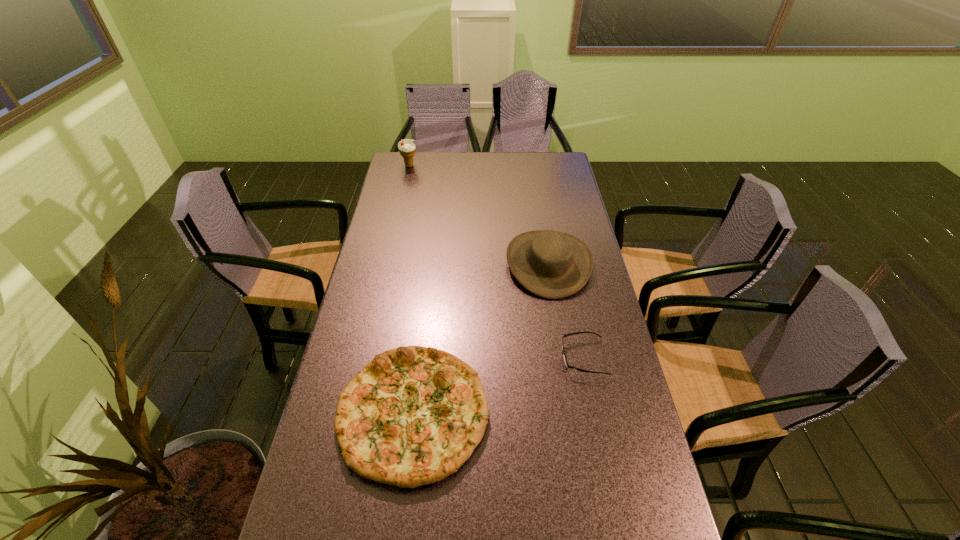
Where is `empty space that is in between the tallest object and the third tallest object`? Image resolution: width=960 pixels, height=540 pixels. empty space that is in between the tallest object and the third tallest object is located at coordinates (412, 289).

Identify the location of vacant point located between the tallest object and the second shortest object. The image size is (960, 540). (412, 289).

You are a GUI agent. You are given a task and a screenshot of the screen. Output one action in this format:
    pyautogui.click(x=<x>, y=<y>)
    Task: Click on the empty location between the third shortest object and the shortest object
    The height and width of the screenshot is (540, 960).
    Given the screenshot: What is the action you would take?
    pyautogui.click(x=565, y=310)

Select which object appears as the second closest to the third shortest object. Please provide its 2D coordinates. Your answer should be formatted as a tuple, i.e. [(x, y)], where the tuple contains the x and y coordinates of a point satisfying the conditions above.

[(412, 416)]

Choose which object is the second nearest neighbor to the shortest object. Please provide its 2D coordinates. Your answer should be formatted as a tuple, i.e. [(x, y)], where the tuple contains the x and y coordinates of a point satisfying the conditions above.

[(412, 416)]

Locate an element on the screen. This screenshot has height=540, width=960. vacant area in the image that satisfies the following two spatial constraints: 1. on the front-facing side of the shortest object; 2. on the front side of the second shortest object is located at coordinates (594, 412).